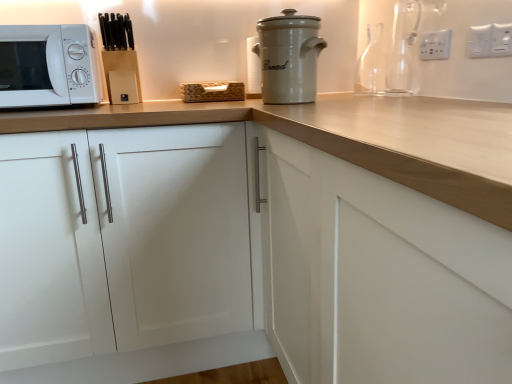
Question: Do you think transparent glass carafe at upper right, arranged as the first bottle when viewed from the front, is within white plastic electric outlet at upper right, the 3th electric outlet from the front, or outside of it?

Choices:
 (A) outside
 (B) inside

Answer: (A)

Question: Is transparent glass carafe at upper right, the second bottle from the back, taller or shorter than white plastic electric outlet at upper right, the 3th electric outlet from the front?

Choices:
 (A) tall
 (B) short

Answer: (A)

Question: Which is nearer to the transparent glass carafe at upper right, the second bottle from the back?

Choices:
 (A) white matte microwave at left
 (B) white plastic electric outlet at upper right, the first electric outlet positioned from the right
 (C) white ceramic bread bin at upper center
 (D) transparent glass bottle at upper right, the 2th bottle from the front
 (E) white matte cabinet at center

Answer: (D)

Question: Estimate the real-world distances between objects in this image. Which object is farther from the white plastic electric outlet at upper right, which ranks as the 2th electric outlet in right-to-left order?

Choices:
 (A) transparent glass carafe at upper right, arranged as the first bottle when viewed from the front
 (B) white ceramic bread bin at upper center
 (C) white matte cabinet at center
 (D) white matte microwave at left
 (E) white plastic electric outlet at upper right, the first electric outlet positioned from the right

Answer: (D)